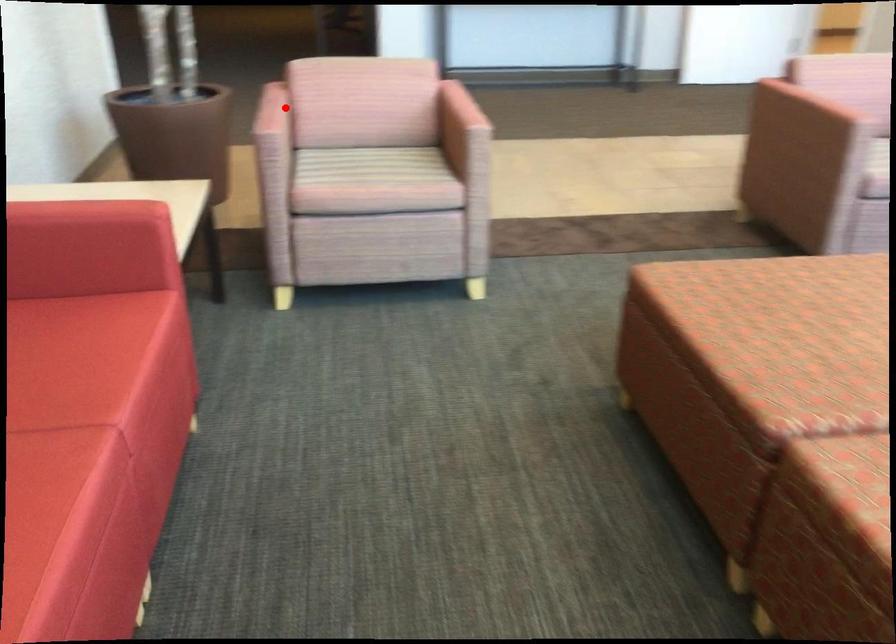
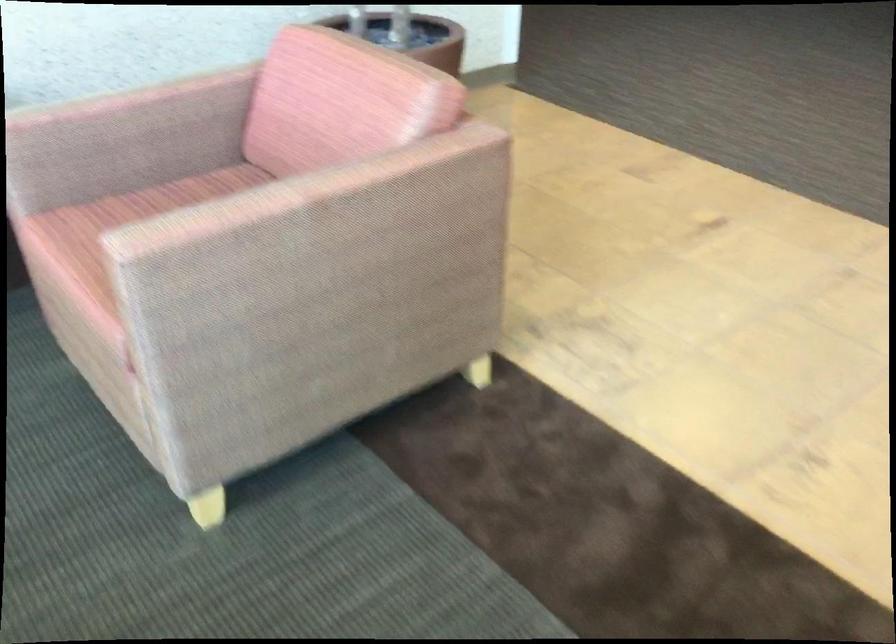
Question: A red point is marked in image1. In image2, is the corresponding 3D point closer to the camera or farther? Reply with the corresponding letter.

Choices:
 (A) The corresponding 3D point is closer.
 (B) The corresponding 3D point is farther.

Answer: (A)